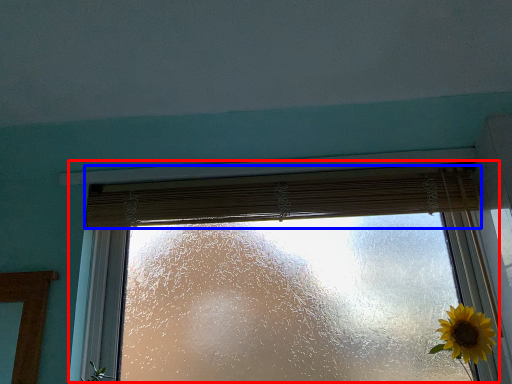
Question: Which point is further to the camera, window (highlighted by a red box) or curtain (highlighted by a blue box)?

Choices:
 (A) window
 (B) curtain

Answer: (B)